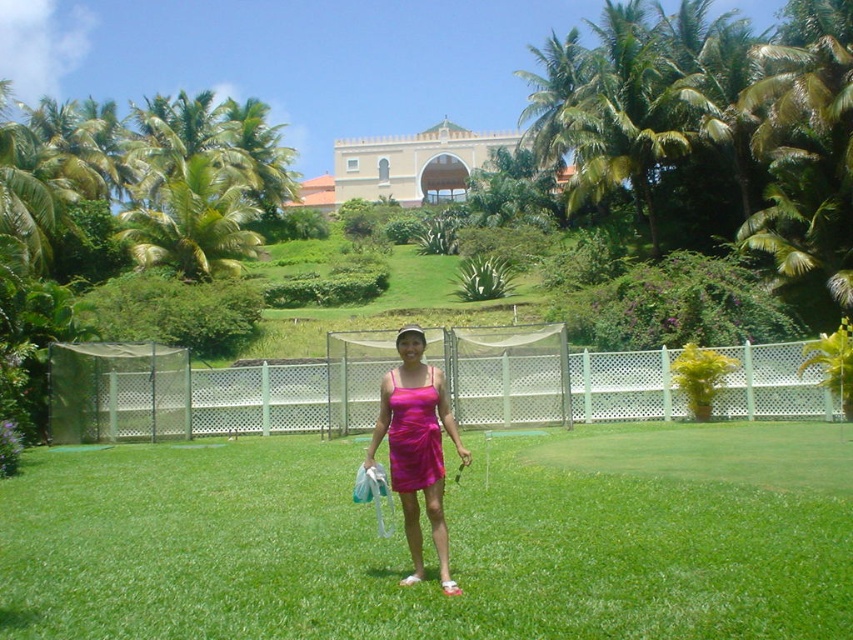
Question: Does pink satin dress at center have a smaller size compared to shiny magenta dress at center?

Choices:
 (A) no
 (B) yes

Answer: (A)

Question: Can you confirm if pink satin dress at center is bigger than shiny magenta dress at center?

Choices:
 (A) no
 (B) yes

Answer: (B)

Question: Which point is closer to the camera taking this photo?

Choices:
 (A) (403, 396)
 (B) (434, 419)

Answer: (A)

Question: Among these objects, which one is farthest from the camera?

Choices:
 (A) pink satin dress at center
 (B) shiny magenta dress at center

Answer: (B)

Question: Which of the following is the farthest from the observer?

Choices:
 (A) shiny magenta dress at center
 (B) pink satin dress at center

Answer: (A)

Question: Can you confirm if pink satin dress at center is smaller than shiny magenta dress at center?

Choices:
 (A) no
 (B) yes

Answer: (A)